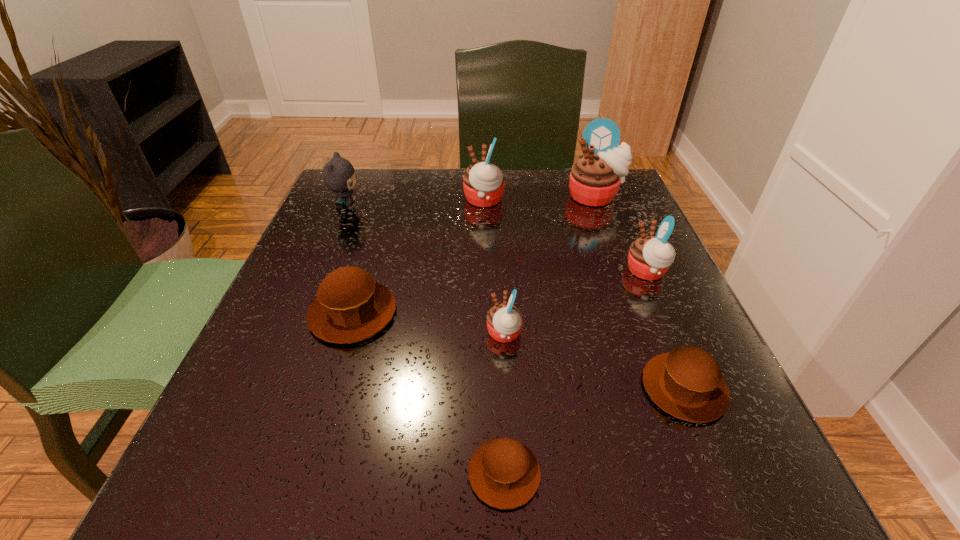
The image size is (960, 540). I want to click on kitten that is positioned at the left edge, so click(339, 176).

The height and width of the screenshot is (540, 960). I want to click on muffin present at the left edge, so click(350, 306).

Locate an element on the screen. The height and width of the screenshot is (540, 960). object positioned at the far left corner is located at coordinates (339, 176).

The width and height of the screenshot is (960, 540). I want to click on object present at the far right corner, so click(x=595, y=178).

Find the location of `free space at the far edge of the desktop`. free space at the far edge of the desktop is located at coordinates pos(397,217).

You are a GUI agent. You are given a task and a screenshot of the screen. Output one action in this format:
    pyautogui.click(x=<x>, y=<y>)
    Task: Click on the vacant space at the near edge of the desktop
    This screenshot has height=540, width=960.
    Given the screenshot: What is the action you would take?
    pyautogui.click(x=346, y=507)

Locate an element on the screen. The width and height of the screenshot is (960, 540). free region at the left edge is located at coordinates (308, 233).

In the image, there is a desktop. At what (x,y) coordinates should I click in order to perform the action: click on vacant space at the right edge. Please return your answer as a coordinate pair (x, y). The width and height of the screenshot is (960, 540). Looking at the image, I should click on (608, 234).

At what (x,y) coordinates should I click in order to perform the action: click on free space at the far left corner of the desktop. Please return your answer as a coordinate pair (x, y). Image resolution: width=960 pixels, height=540 pixels. Looking at the image, I should click on (367, 187).

In the image, there is a desktop. Identify the location of free space at the near left corner. The width and height of the screenshot is (960, 540). (202, 452).